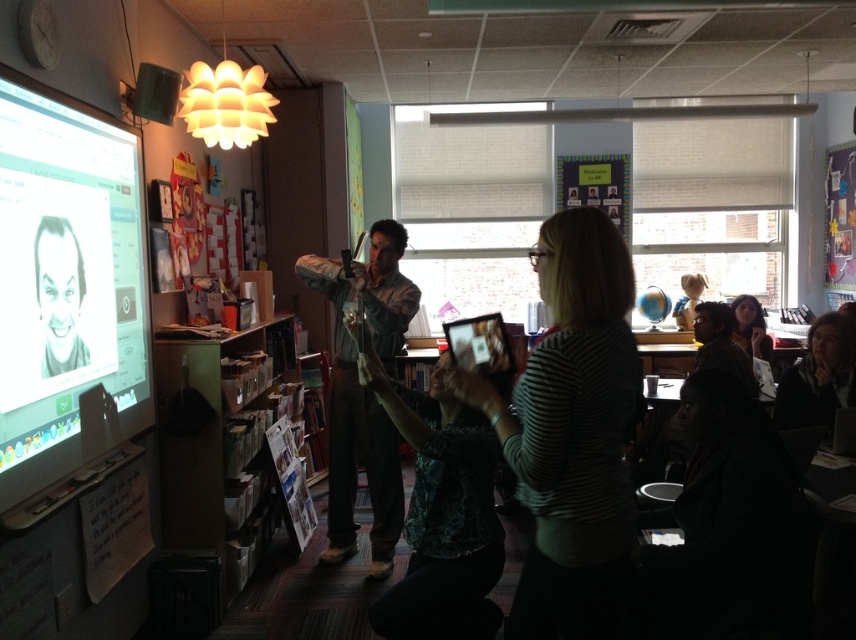
You are a student sitting in the classroom and want to take a photo of the white glossy screen at left and the matte black hair at upper right. Which object will appear smaller in your photo?

The white glossy screen at left will appear smaller in your photo because it has a smaller size compared to the matte black hair at upper right.

Looking at this image, you are a student sitting at the desk in the classroom and want to reach both the point at (197,433) and the point at (746,344). Which point is closer to you?

Point at (197,433) is closer to you because it is in front of point at (746,344).

You are a student sitting at the back of the classroom. You want to take a photo of the striped fabric shirt at center and the white glossy screen at left. Your camera has a minimum focus distance of 4 feet. Can you focus on both objects at the same time?

The white glossy screen at left and striped fabric shirt at center are 5.07 feet apart. Since the minimum focus distance is 4 feet, the camera can focus on both objects simultaneously as the distance between them is greater than the required minimum focus distance.